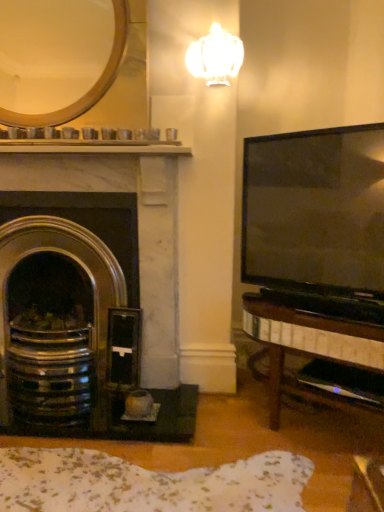
This screenshot has height=512, width=384. Identify the location of white glossy lamp at upper center. (215, 57).

Image resolution: width=384 pixels, height=512 pixels. In order to click on gold metallic mirror at upper left in this screenshot , I will do `click(52, 51)`.

Locate an element on the screen. white glossy lamp at upper center is located at coordinates (215, 57).

Which is more to the right, gold metallic mirror at upper left or polished brass fireplace at left?

From the viewer's perspective, gold metallic mirror at upper left appears more on the right side.

Is gold metallic mirror at upper left inside or outside of polished brass fireplace at left?

gold metallic mirror at upper left is outside polished brass fireplace at left.

Is gold metallic mirror at upper left positioned far away from polished brass fireplace at left?

That's not correct — gold metallic mirror at upper left is a little close to polished brass fireplace at left.

Where is `fireplace below the gold metallic mirror at upper left (from a real-world perspective)`? This screenshot has width=384, height=512. fireplace below the gold metallic mirror at upper left (from a real-world perspective) is located at coordinates (89, 298).

What are the coordinates of `fireplace behind the white glossy lamp at upper center` in the screenshot? It's located at (89, 298).

Is white glossy lamp at upper center aimed at polished brass fireplace at left?

No, white glossy lamp at upper center is not aimed at polished brass fireplace at left.

From the image's perspective, is white glossy lamp at upper center below polished brass fireplace at left?

No.

Consider the image. What's the angular difference between white glossy lamp at upper center and polished brass fireplace at left's facing directions?

0.622 degrees.

Considering the relative sizes of gold metallic mirror at upper left and white glossy lamp at upper center in the image provided, is gold metallic mirror at upper left bigger than white glossy lamp at upper center?

Correct, gold metallic mirror at upper left is larger in size than white glossy lamp at upper center.

From a real-world perspective, is gold metallic mirror at upper left positioned above or below white glossy lamp at upper center?

From a real-world perspective, gold metallic mirror at upper left is physically below white glossy lamp at upper center.

From the image's perspective, is gold metallic mirror at upper left on white glossy lamp at upper center?

No, from the image's perspective, gold metallic mirror at upper left is not over white glossy lamp at upper center.

What's the angular difference between gold metallic mirror at upper left and white glossy lamp at upper center's facing directions?

There is a 0.00164-degree angle between the facing directions of gold metallic mirror at upper left and white glossy lamp at upper center.

From the image's perspective, would you say polished brass fireplace at left is positioned over gold metallic mirror at upper left?

No, from the image's perspective, polished brass fireplace at left is not on top of gold metallic mirror at upper left.

Considering their positions, is polished brass fireplace at left located in front of or behind gold metallic mirror at upper left?

Visually, polished brass fireplace at left is located behind gold metallic mirror at upper left.

You are a GUI agent. You are given a task and a screenshot of the screen. Output one action in this format:
    pyautogui.click(x=<x>, y=<y>)
    Task: Click on the mirror that is on the right side of polished brass fireplace at left
    
    Given the screenshot: What is the action you would take?
    pyautogui.click(x=52, y=51)

Can you confirm if polished brass fireplace at left is shorter than gold metallic mirror at upper left?

In fact, polished brass fireplace at left may be taller than gold metallic mirror at upper left.

From the image's perspective, which object appears higher, white glossy lamp at upper center or gold metallic mirror at upper left?

white glossy lamp at upper center appears higher in the image.

Is white glossy lamp at upper center thinner than gold metallic mirror at upper left?

Correct, the width of white glossy lamp at upper center is less than that of gold metallic mirror at upper left.

Locate an element on the screen. This screenshot has width=384, height=512. lamp that appears above the gold metallic mirror at upper left (from a real-world perspective) is located at coordinates (215, 57).

Is white glossy lamp at upper center situated inside gold metallic mirror at upper left or outside?

The correct answer is: outside.

In terms of height, does polished brass fireplace at left look taller or shorter compared to white glossy lamp at upper center?

polished brass fireplace at left is taller than white glossy lamp at upper center.

Does polished brass fireplace at left contain white glossy lamp at upper center?

No, polished brass fireplace at left does not contain white glossy lamp at upper center.

Which is behind, point (157, 261) or point (209, 38)?

The point (157, 261) is behind.

Is polished brass fireplace at left oriented away from white glossy lamp at upper center?

No, white glossy lamp at upper center is not at the back of polished brass fireplace at left.

In the image, there is a gold metallic mirror at upper left. Where is `fireplace below it (from a real-world perspective)`? fireplace below it (from a real-world perspective) is located at coordinates (89, 298).

Where is `fireplace behind the white glossy lamp at upper center`? fireplace behind the white glossy lamp at upper center is located at coordinates (89, 298).

From the image, which object appears to be farther from gold metallic mirror at upper left, white glossy lamp at upper center or polished brass fireplace at left?

polished brass fireplace at left lies further to gold metallic mirror at upper left than the other object.

Based on their spatial positions, is gold metallic mirror at upper left or polished brass fireplace at left closer to white glossy lamp at upper center?

Among the two, gold metallic mirror at upper left is located nearer to white glossy lamp at upper center.

Looking at the image, which one is located further to white glossy lamp at upper center, polished brass fireplace at left or gold metallic mirror at upper left?

polished brass fireplace at left is positioned further to the anchor white glossy lamp at upper center.

Considering their positions, is white glossy lamp at upper center positioned closer to polished brass fireplace at left than gold metallic mirror at upper left?

The object closer to polished brass fireplace at left is gold metallic mirror at upper left.

Estimate the real-world distances between objects in this image. Which object is closer to polished brass fireplace at left, gold metallic mirror at upper left or white glossy lamp at upper center?

gold metallic mirror at upper left is closer to polished brass fireplace at left.

From the picture: Which object lies further to the anchor point gold metallic mirror at upper left, polished brass fireplace at left or white glossy lamp at upper center?

Based on the image, polished brass fireplace at left appears to be further to gold metallic mirror at upper left.

Find the location of a particular element. This screenshot has width=384, height=512. mirror between white glossy lamp at upper center and polished brass fireplace at left vertically is located at coordinates (52, 51).